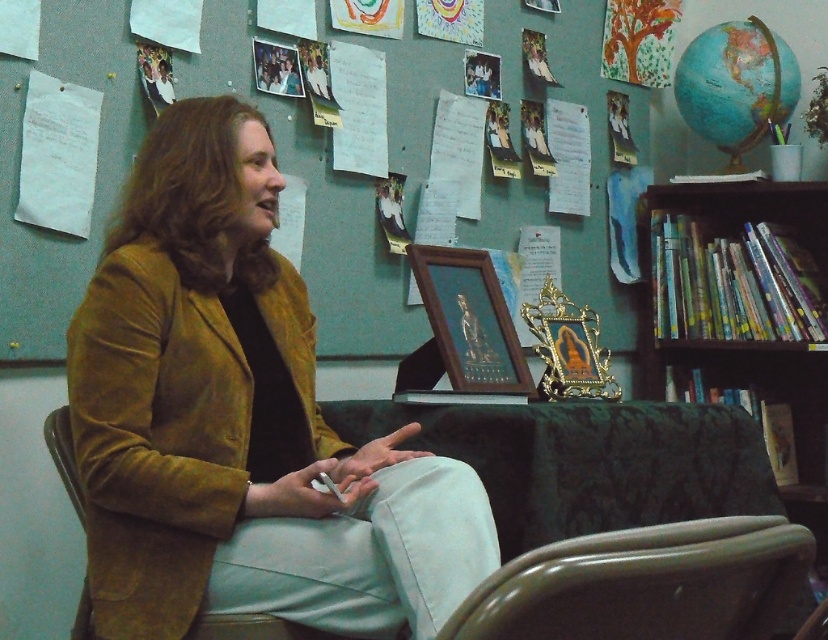
Question: Which is farther from the leather-like beige swivel chair at lower right?

Choices:
 (A) woodenobject at center
 (B) dark wood bookshelf at right
 (C) brown silky hair at upper left
 (D) velvet mustard jacket at center

Answer: (B)

Question: Is leather-like beige swivel chair at lower right in front of brown silky hair at upper left?

Choices:
 (A) no
 (B) yes

Answer: (B)

Question: Which object is farther from the camera taking this photo?

Choices:
 (A) dark wood bookshelf at right
 (B) velvet mustard jacket at center

Answer: (A)

Question: From the image, what is the correct spatial relationship of velvet mustard jacket at center in relation to leather-like beige swivel chair at lower right?

Choices:
 (A) right
 (B) left

Answer: (B)

Question: Which object is positioned farthest from the brown silky hair at upper left?

Choices:
 (A) leather-like beige swivel chair at lower right
 (B) velvet mustard jacket at center

Answer: (A)

Question: Is brown silky hair at upper left to the left of woodenobject at center from the viewer's perspective?

Choices:
 (A) yes
 (B) no

Answer: (A)